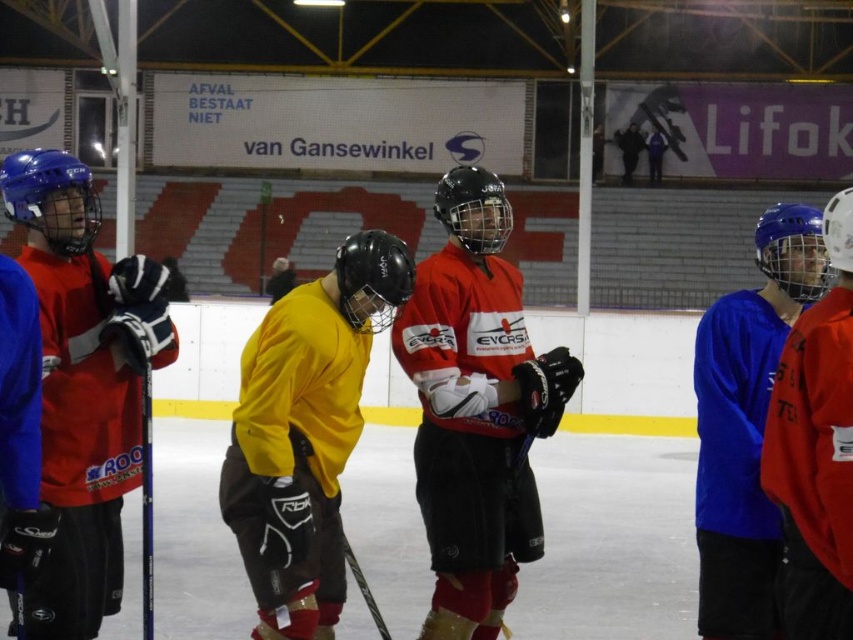
Can you confirm if matte red hockey jersey at center is bigger than matte blue helmet at left?

Actually, matte red hockey jersey at center might be smaller than matte blue helmet at left.

Locate an element on the screen. The image size is (853, 640). matte red hockey jersey at center is located at coordinates (476, 408).

Is point (534, 404) positioned before point (64, 621)?

That is False.

In order to click on matte red hockey jersey at center in this screenshot , I will do `click(476, 408)`.

Is point (631, 163) more distant than point (276, 260)?

That is True.

Between point (633, 156) and point (271, 288), which one is positioned in front?

Positioned in front is point (271, 288).

The image size is (853, 640). Identify the location of black matte jacket at upper center. (630, 148).

Which is above, matte blue helmet at upper right or matte blue hockey stick at left?

matte blue hockey stick at left is above.

Is matte blue helmet at upper right to the left of matte blue hockey stick at left from the viewer's perspective?

In fact, matte blue helmet at upper right is to the right of matte blue hockey stick at left.

The image size is (853, 640). What do you see at coordinates (816, 449) in the screenshot?
I see `matte blue helmet at upper right` at bounding box center [816, 449].

Locate an element on the screen. matte blue helmet at upper right is located at coordinates (816, 449).